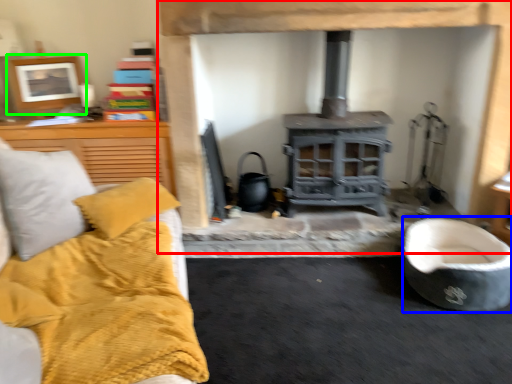
Question: Estimate the real-world distances between objects in this image. Which object is closer to fireplace (highlighted by a red box), rocking chair (highlighted by a blue box) or picture frame (highlighted by a green box)?

Choices:
 (A) rocking chair
 (B) picture frame

Answer: (A)